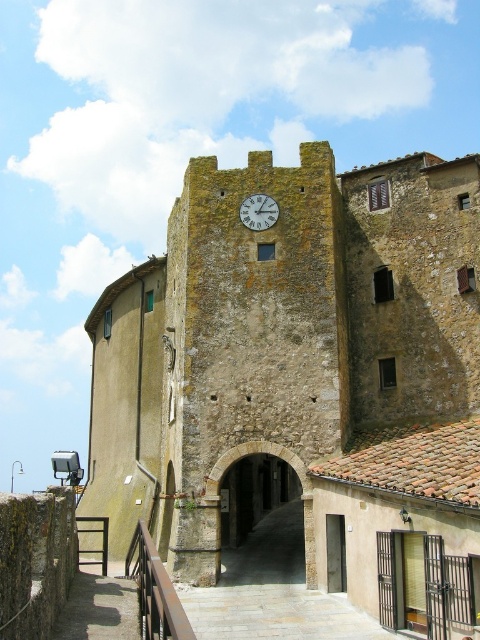
Question: Among these objects, which one is farthest from the camera?

Choices:
 (A) brown metal/rail at lower left
 (B) brown stone clock tower at center
 (C) green stone clock at center

Answer: (C)

Question: Considering the relative positions of brown metal/rail at lower left and green stone clock at center in the image provided, where is brown metal/rail at lower left located with respect to green stone clock at center?

Choices:
 (A) above
 (B) below

Answer: (B)

Question: Which point is farther to the camera?

Choices:
 (A) green stone clock at center
 (B) brown stone clock tower at center

Answer: (A)

Question: Does brown metal/rail at lower left appear on the left side of green stone clock at center?

Choices:
 (A) yes
 (B) no

Answer: (A)

Question: Is brown metal/rail at lower left closer to camera compared to green stone clock at center?

Choices:
 (A) yes
 (B) no

Answer: (A)

Question: Which object is the farthest from the green stone clock at center?

Choices:
 (A) brown metal/rail at lower left
 (B) brown stone clock tower at center

Answer: (A)